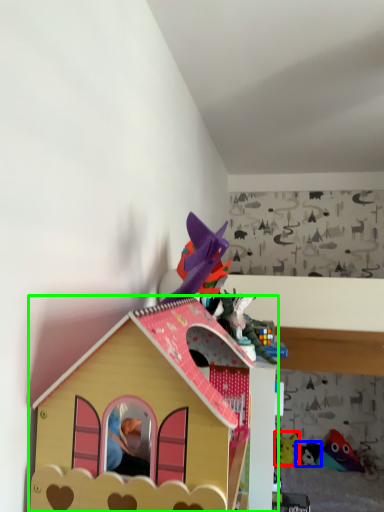
Question: Which object is the closest to the toy (highlighted by a red box)? Choose among these: toy (highlighted by a blue box) or toy (highlighted by a green box).

Choices:
 (A) toy
 (B) toy

Answer: (A)